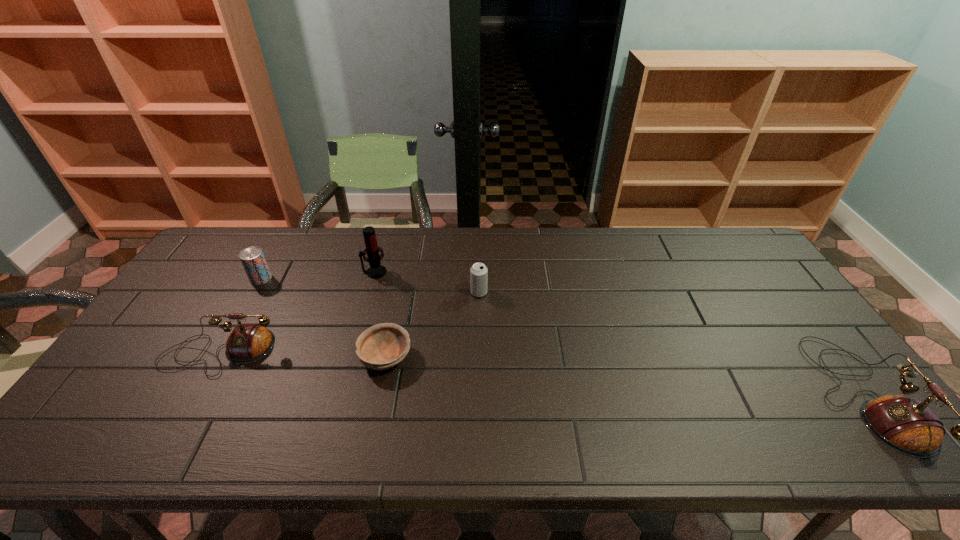
Please point a spot to place another telephone for symmetrical spacing. Please provide its 2D coordinates. Your answer should be formatted as a tuple, i.e. [(x, y)], where the tuple contains the x and y coordinates of a point satisfying the conditions above.

[(527, 373)]